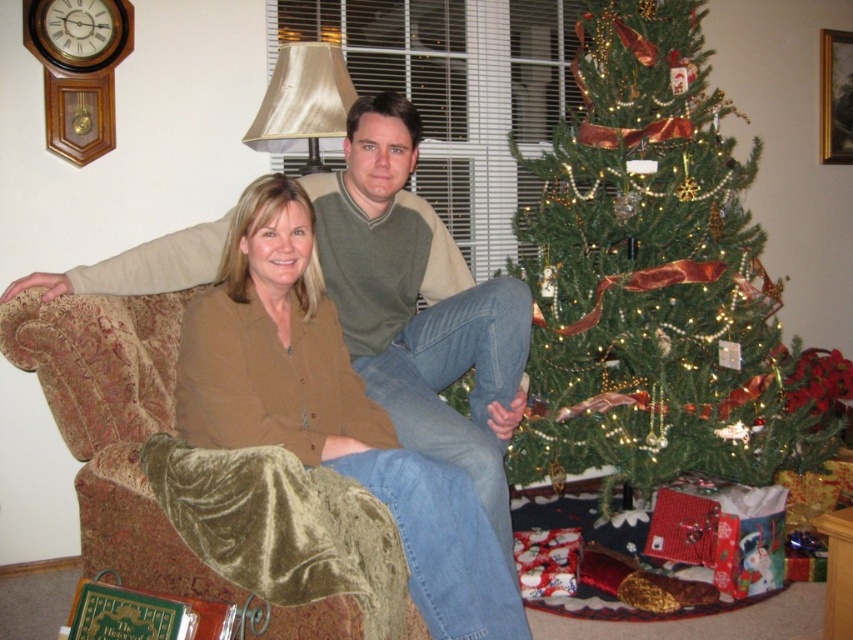
Question: Does green textured christmas tree at center appear over matte brown shirt at center?

Choices:
 (A) yes
 (B) no

Answer: (A)

Question: Can you confirm if green textured christmas tree at center is thinner than matte brown shirt at center?

Choices:
 (A) yes
 (B) no

Answer: (B)

Question: Considering the relative positions of green textured christmas tree at center and matte brown shirt at center in the image provided, where is green textured christmas tree at center located with respect to matte brown shirt at center?

Choices:
 (A) above
 (B) below

Answer: (A)

Question: Which of the following is the farthest from the observer?

Choices:
 (A) matte brown shirt at center
 (B) green textured christmas tree at center

Answer: (B)

Question: Which of the following is the farthest from the observer?

Choices:
 (A) (262, 388)
 (B) (709, 305)

Answer: (B)